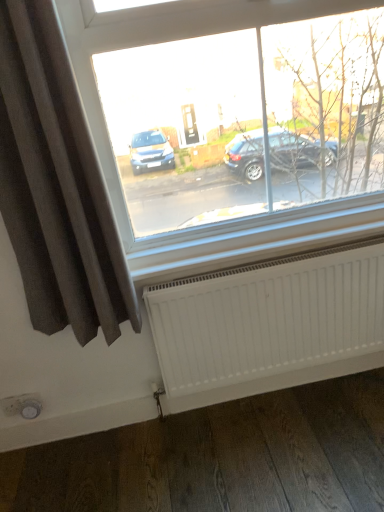
Question: Would you say white matte radiator at lower center is a long distance from dark grey fabric curtain at left?

Choices:
 (A) no
 (B) yes

Answer: (A)

Question: Is dark grey fabric curtain at left surrounded by white matte radiator at lower center?

Choices:
 (A) no
 (B) yes

Answer: (A)

Question: From a real-world perspective, is white matte radiator at lower center under dark grey fabric curtain at left?

Choices:
 (A) yes
 (B) no

Answer: (A)

Question: Is dark grey fabric curtain at left at the back of white matte radiator at lower center?

Choices:
 (A) yes
 (B) no

Answer: (B)

Question: Is white matte radiator at lower center outside of dark grey fabric curtain at left?

Choices:
 (A) no
 (B) yes

Answer: (B)

Question: Does white matte radiator at lower center have a lesser width compared to dark grey fabric curtain at left?

Choices:
 (A) yes
 (B) no

Answer: (A)

Question: Can you confirm if dark grey fabric curtain at left is thinner than white matte radiator at lower center?

Choices:
 (A) yes
 (B) no

Answer: (B)

Question: Is dark grey fabric curtain at left in contact with white matte radiator at lower center?

Choices:
 (A) no
 (B) yes

Answer: (A)

Question: Is dark grey fabric curtain at left positioned behind white matte radiator at lower center?

Choices:
 (A) no
 (B) yes

Answer: (A)

Question: Considering the relative sizes of dark grey fabric curtain at left and white matte radiator at lower center in the image provided, is dark grey fabric curtain at left shorter than white matte radiator at lower center?

Choices:
 (A) yes
 (B) no

Answer: (B)

Question: Is white matte radiator at lower center located within dark grey fabric curtain at left?

Choices:
 (A) no
 (B) yes

Answer: (A)

Question: From the image's perspective, is dark grey fabric curtain at left located above white matte radiator at lower center?

Choices:
 (A) yes
 (B) no

Answer: (A)

Question: Is dark grey fabric curtain at left in front of or behind white matte radiator at lower center in the image?

Choices:
 (A) behind
 (B) front

Answer: (B)